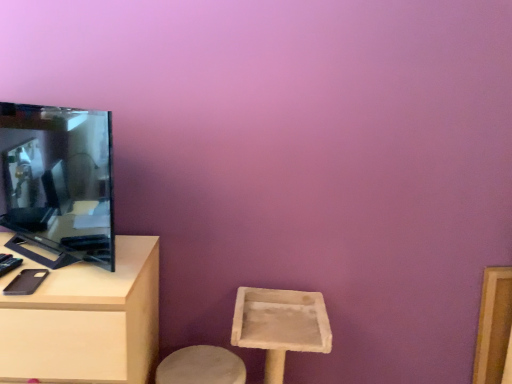
Question: Based on their positions, is matte black tv at left located to the left or right of light wood table at left?

Choices:
 (A) right
 (B) left

Answer: (A)

Question: Is point (75, 152) positioned closer to the camera than point (83, 324)?

Choices:
 (A) farther
 (B) closer

Answer: (A)

Question: Is matte black tv at left bigger or smaller than light wood table at left?

Choices:
 (A) small
 (B) big

Answer: (A)

Question: In terms of width, does light wood table at left look wider or thinner when compared to matte black tv at left?

Choices:
 (A) wide
 (B) thin

Answer: (A)

Question: From a real-world perspective, relative to matte black tv at left, is light wood table at left vertically above or below?

Choices:
 (A) above
 (B) below

Answer: (B)

Question: Based on their sizes in the image, would you say light wood table at left is bigger or smaller than matte black tv at left?

Choices:
 (A) big
 (B) small

Answer: (A)

Question: Is point (152, 289) positioned closer to the camera than point (55, 177)?

Choices:
 (A) farther
 (B) closer

Answer: (A)